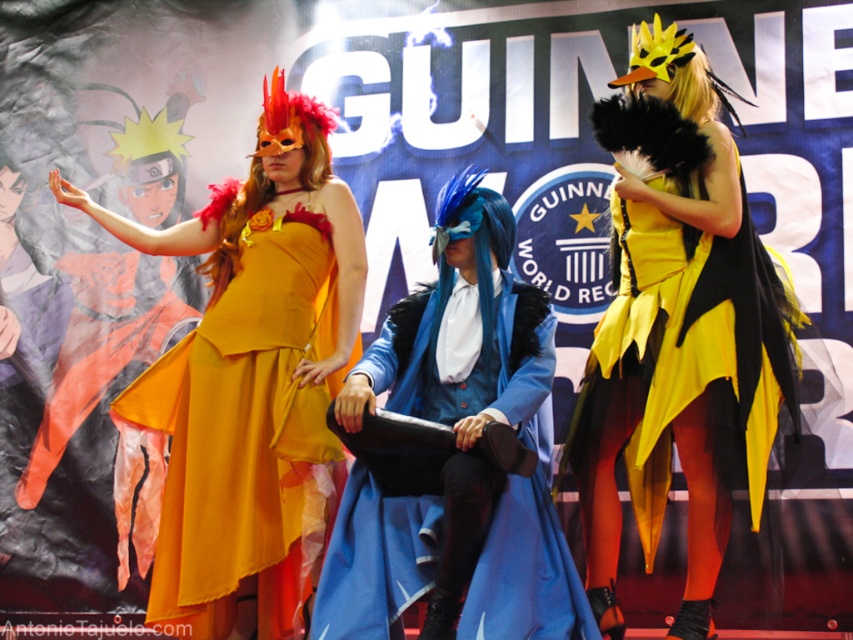
Question: Is matte yellow dress at center above blue velvet coat at center?

Choices:
 (A) no
 (B) yes

Answer: (B)

Question: Is matte yellow dress at center positioned before yellow satin dress at center?

Choices:
 (A) yes
 (B) no

Answer: (B)

Question: Which object is farther from the camera taking this photo?

Choices:
 (A) blue velvet coat at center
 (B) matte yellow dress at center

Answer: (B)

Question: Which object is farther from the camera taking this photo?

Choices:
 (A) yellow satin dress at center
 (B) matte yellow dress at center
 (C) blue velvet coat at center

Answer: (B)

Question: Which of the following is the closest to the observer?

Choices:
 (A) matte yellow dress at center
 (B) yellow satin dress at center

Answer: (B)

Question: Can you confirm if matte yellow dress at center is positioned to the right of blue velvet coat at center?

Choices:
 (A) yes
 (B) no

Answer: (B)